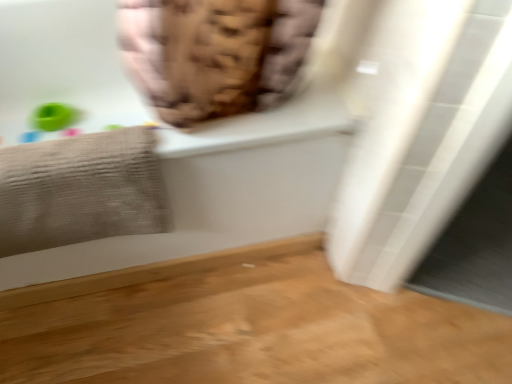
Question: Is gray textured towel at left bigger or smaller than white glossy bathtub at upper center?

Choices:
 (A) small
 (B) big

Answer: (A)

Question: From a real-world perspective, is gray textured towel at left positioned above or below white glossy bathtub at upper center?

Choices:
 (A) below
 (B) above

Answer: (B)

Question: From the image's perspective, is gray textured towel at left located above or below white glossy bathtub at upper center?

Choices:
 (A) above
 (B) below

Answer: (B)

Question: From a real-world perspective, is white glossy bathtub at upper center above or below gray textured towel at left?

Choices:
 (A) above
 (B) below

Answer: (B)

Question: Is white glossy bathtub at upper center spatially inside gray textured towel at left, or outside of it?

Choices:
 (A) inside
 (B) outside

Answer: (B)

Question: Visually, is white glossy bathtub at upper center positioned to the left or to the right of gray textured towel at left?

Choices:
 (A) left
 (B) right

Answer: (B)

Question: Considering the positions of white glossy bathtub at upper center and gray textured towel at left in the image, is white glossy bathtub at upper center taller or shorter than gray textured towel at left?

Choices:
 (A) tall
 (B) short

Answer: (A)